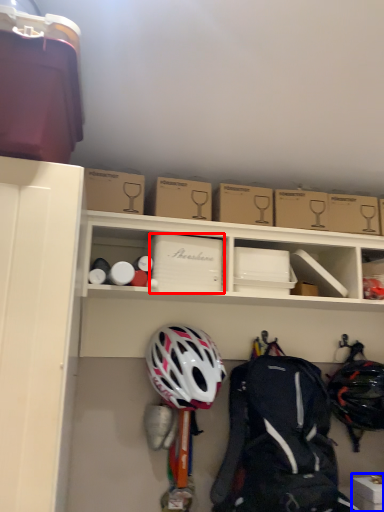
Question: Which point is further to the camera, cardboard box (highlighted by a red box) or storage box (highlighted by a blue box)?

Choices:
 (A) cardboard box
 (B) storage box

Answer: (A)